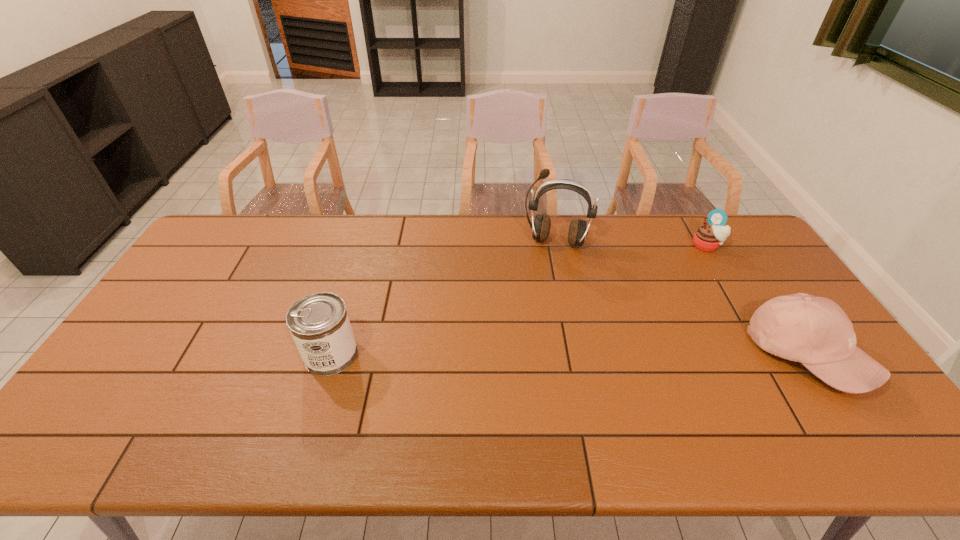
At what (x,y) coordinates should I click in order to perform the action: click on empty space that is in between the leftmost object and the shortest object. Please return your answer as a coordinate pair (x, y). Image resolution: width=960 pixels, height=540 pixels. Looking at the image, I should click on (518, 300).

The width and height of the screenshot is (960, 540). I want to click on empty space that is in between the muffin and the baseball cap, so click(756, 300).

The width and height of the screenshot is (960, 540). Identify the location of free spot between the muffin and the can. (518, 300).

Identify which object is the nearest to the can. Please provide its 2D coordinates. Your answer should be formatted as a tuple, i.e. [(x, y)], where the tuple contains the x and y coordinates of a point satisfying the conditions above.

[(578, 230)]

Identify the location of object that ranks as the third closest to the tallest object. [x=319, y=324].

In order to click on free space that satisfies the following two spatial constraints: 1. on the front side of the baseball cap; 2. on the front-facing side of the leftmost object in this screenshot , I will do `click(331, 355)`.

The height and width of the screenshot is (540, 960). Find the location of `blank area in the image that satisfies the following two spatial constraints: 1. on the back side of the muffin; 2. on the right side of the can`. blank area in the image that satisfies the following two spatial constraints: 1. on the back side of the muffin; 2. on the right side of the can is located at coordinates (364, 246).

Identify the location of vacant space that satisfies the following two spatial constraints: 1. on the front side of the baseball cap; 2. on the front-facing side of the shortest object. (771, 355).

The image size is (960, 540). I want to click on vacant position in the image that satisfies the following two spatial constraints: 1. on the front side of the baseball cap; 2. on the front-facing side of the third object from right to left, so 579,355.